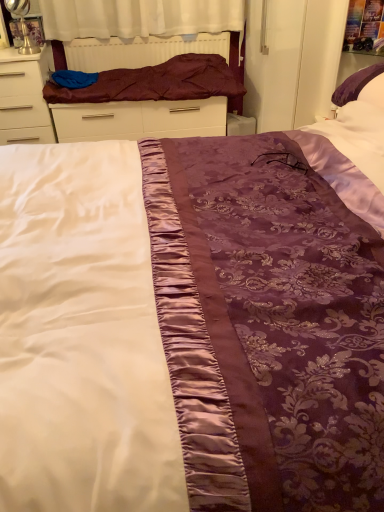
Question: Based on their positions, is white glossy chest of drawers at left located to the left or right of maroon satin blanket at upper left?

Choices:
 (A) right
 (B) left

Answer: (B)

Question: Do you think white glossy chest of drawers at left is within maroon satin blanket at upper left, or outside of it?

Choices:
 (A) outside
 (B) inside

Answer: (A)

Question: Which is farther from the white glossy chest of drawers at left?

Choices:
 (A) maroon satin bed frame at upper center
 (B) maroon satin blanket at upper left

Answer: (B)

Question: Estimate the real-world distances between objects in this image. Which object is farther from the white glossy chest of drawers at left?

Choices:
 (A) maroon satin bed frame at upper center
 (B) maroon satin blanket at upper left

Answer: (B)